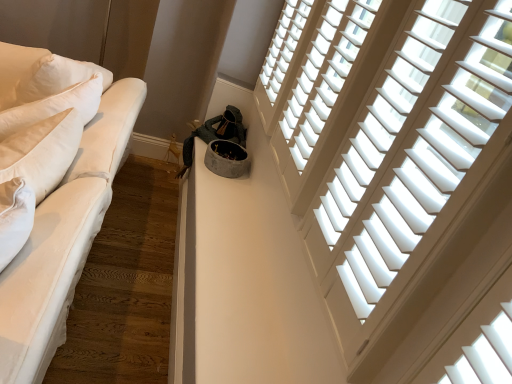
Question: Is white wood blinds at upper right, placed as the second window when sorted from front to back, smaller than white wood blinds at upper right, marked as the first window in a front-to-back arrangement?

Choices:
 (A) no
 (B) yes

Answer: (B)

Question: Is white wood blinds at upper right, the 2th window in the back-to-front sequence, not within white wood blinds at upper right, marked as the first window in a front-to-back arrangement?

Choices:
 (A) yes
 (B) no

Answer: (A)

Question: Is white wood blinds at upper right, placed as the second window when sorted from front to back, wider than white wood blinds at upper right, arranged as the third window when viewed from the back?

Choices:
 (A) yes
 (B) no

Answer: (B)

Question: From a real-world perspective, is white wood blinds at upper right, placed as the second window when sorted from front to back, on top of white wood blinds at upper right, arranged as the third window when viewed from the back?

Choices:
 (A) yes
 (B) no

Answer: (B)

Question: Is white wood blinds at upper right, marked as the first window in a front-to-back arrangement, at the back of white wood blinds at upper right, placed as the second window when sorted from front to back?

Choices:
 (A) yes
 (B) no

Answer: (B)

Question: From the image's perspective, is white wood blinds at upper right, the 2th window in the back-to-front sequence, over white wood blinds at upper right, marked as the first window in a front-to-back arrangement?

Choices:
 (A) no
 (B) yes

Answer: (B)

Question: Does white cotton studio couch at left come behind white wood blinds at upper right, arranged as the third window when viewed from the back?

Choices:
 (A) no
 (B) yes

Answer: (A)

Question: Does white cotton studio couch at left have a lesser width compared to white wood blinds at upper right, marked as the first window in a front-to-back arrangement?

Choices:
 (A) no
 (B) yes

Answer: (A)

Question: Does white cotton studio couch at left turn towards white wood blinds at upper right, arranged as the third window when viewed from the back?

Choices:
 (A) no
 (B) yes

Answer: (A)

Question: Does white cotton studio couch at left contain white wood blinds at upper right, marked as the first window in a front-to-back arrangement?

Choices:
 (A) yes
 (B) no

Answer: (B)

Question: Considering the relative sizes of white cotton studio couch at left and white wood blinds at upper right, arranged as the third window when viewed from the back, in the image provided, is white cotton studio couch at left bigger than white wood blinds at upper right, arranged as the third window when viewed from the back,?

Choices:
 (A) yes
 (B) no

Answer: (A)

Question: From the image's perspective, is white cotton studio couch at left below white wood blinds at upper right, arranged as the third window when viewed from the back?

Choices:
 (A) yes
 (B) no

Answer: (A)

Question: Can you confirm if white wood blinds at upper right, the third window in the front-to-back sequence, is taller than white wood blinds at upper right, placed as the second window when sorted from front to back?

Choices:
 (A) no
 (B) yes

Answer: (A)